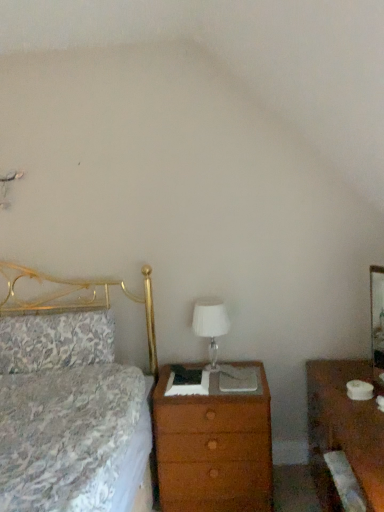
Question: Is floral fabric pillow at left not near brown wood nightstand at right?

Choices:
 (A) yes
 (B) no

Answer: (A)

Question: Does floral fabric pillow at left appear on the right side of brown wood nightstand at right?

Choices:
 (A) no
 (B) yes

Answer: (A)

Question: Is floral fabric pillow at left closer to camera compared to brown wood nightstand at right?

Choices:
 (A) yes
 (B) no

Answer: (B)

Question: Is floral fabric pillow at left bigger than brown wood nightstand at right?

Choices:
 (A) yes
 (B) no

Answer: (B)

Question: Is floral fabric pillow at left aimed at brown wood nightstand at right?

Choices:
 (A) no
 (B) yes

Answer: (A)

Question: From a real-world perspective, is white glass table lamp at center above or below floral fabric pillow at left?

Choices:
 (A) above
 (B) below

Answer: (B)

Question: From the image's perspective, is white glass table lamp at center positioned above or below floral fabric pillow at left?

Choices:
 (A) below
 (B) above

Answer: (B)

Question: Is white glass table lamp at center in front of or behind floral fabric pillow at left in the image?

Choices:
 (A) front
 (B) behind

Answer: (A)

Question: Would you say white glass table lamp at center is inside or outside floral fabric pillow at left?

Choices:
 (A) outside
 (B) inside

Answer: (A)

Question: Considering the positions of wooden chest of drawers at center and brown wood nightstand at right in the image, is wooden chest of drawers at center bigger or smaller than brown wood nightstand at right?

Choices:
 (A) big
 (B) small

Answer: (B)

Question: Is wooden chest of drawers at center to the left or to the right of brown wood nightstand at right in the image?

Choices:
 (A) left
 (B) right

Answer: (A)

Question: In terms of width, does wooden chest of drawers at center look wider or thinner when compared to brown wood nightstand at right?

Choices:
 (A) wide
 (B) thin

Answer: (A)

Question: From a real-world perspective, relative to brown wood nightstand at right, is wooden chest of drawers at center vertically above or below?

Choices:
 (A) below
 (B) above

Answer: (A)

Question: Is point (324, 474) closer or farther from the camera than point (198, 410)?

Choices:
 (A) farther
 (B) closer

Answer: (B)

Question: In the image, is brown wood nightstand at right on the left side or the right side of wooden chest of drawers at center?

Choices:
 (A) left
 (B) right

Answer: (B)